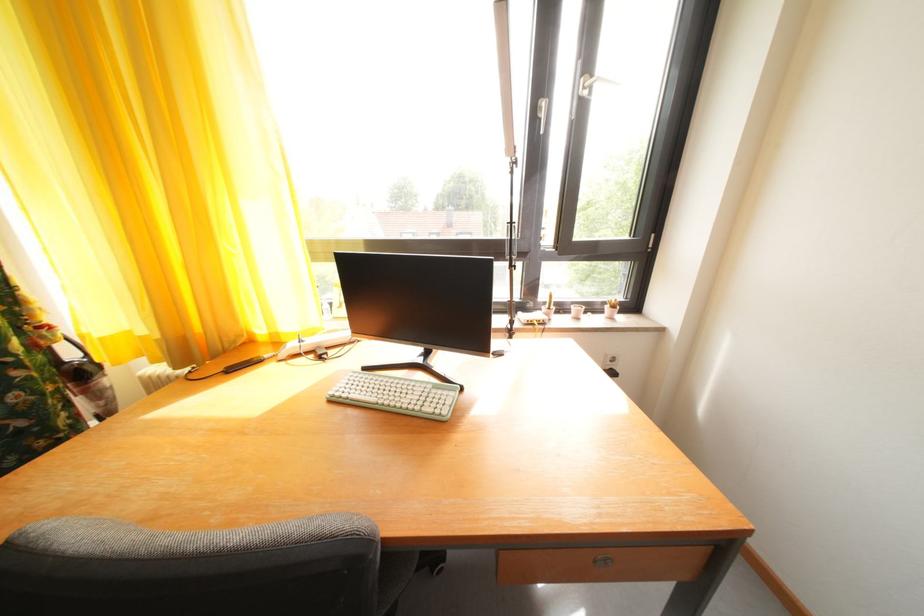
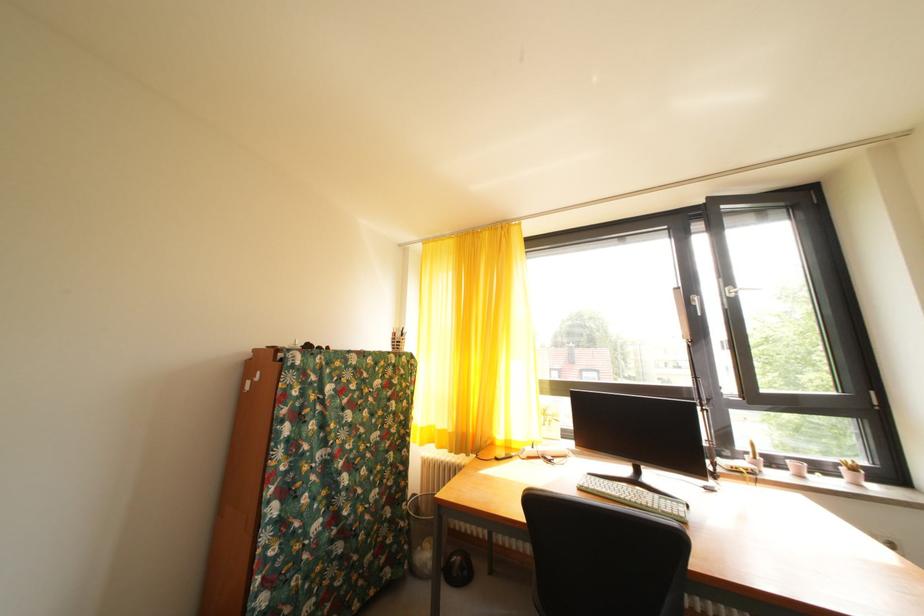
Based on the continuous images, in which direction is the camera rotating?

The camera rotated toward left-up.